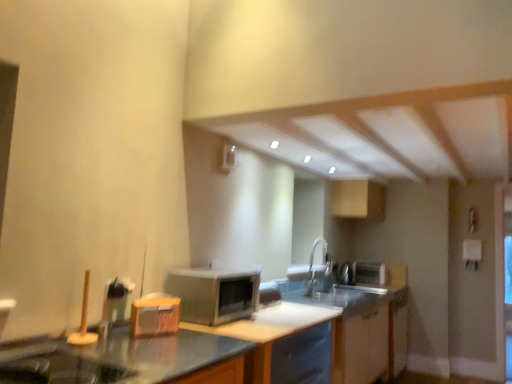
Question: Are silver metallic faucet at center and white glossy counter top at center beside each other?

Choices:
 (A) no
 (B) yes

Answer: (A)

Question: Is silver metallic faucet at center shorter than white glossy counter top at center?

Choices:
 (A) no
 (B) yes

Answer: (B)

Question: Is silver metallic faucet at center thinner than white glossy counter top at center?

Choices:
 (A) no
 (B) yes

Answer: (B)

Question: Is the depth of silver metallic faucet at center less than that of white glossy counter top at center?

Choices:
 (A) yes
 (B) no

Answer: (B)

Question: Is silver metallic faucet at center not inside white glossy counter top at center?

Choices:
 (A) no
 (B) yes

Answer: (B)

Question: Does silver metallic faucet at center have a smaller size compared to white glossy counter top at center?

Choices:
 (A) yes
 (B) no

Answer: (A)

Question: Is satin silver microwave at center surrounded by white glossy counter top at center?

Choices:
 (A) no
 (B) yes

Answer: (A)

Question: Does white glossy counter top at center have a lesser width compared to satin silver microwave at center?

Choices:
 (A) no
 (B) yes

Answer: (A)

Question: Does white glossy counter top at center appear on the left side of satin silver microwave at center?

Choices:
 (A) no
 (B) yes

Answer: (A)

Question: Is white glossy counter top at center at the right side of satin silver microwave at center?

Choices:
 (A) yes
 (B) no

Answer: (A)

Question: Is white glossy counter top at center in front of satin silver microwave at center?

Choices:
 (A) yes
 (B) no

Answer: (A)

Question: From the image's perspective, is white glossy counter top at center over satin silver microwave at center?

Choices:
 (A) no
 (B) yes

Answer: (A)

Question: Can you confirm if satin silver microwave at center is shorter than white glossy cabinet at lower center, which is the 1th cabinetry in front-to-back order?

Choices:
 (A) yes
 (B) no

Answer: (A)